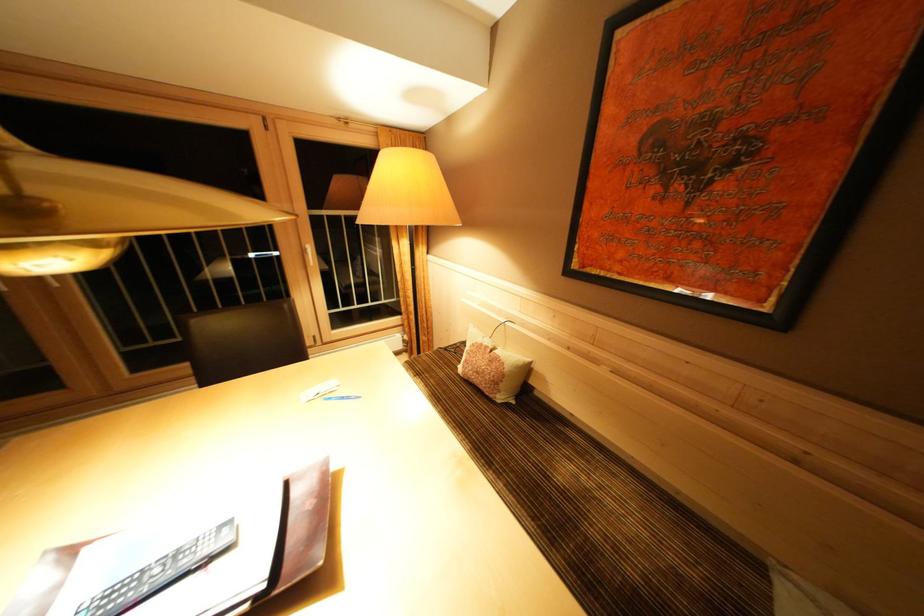
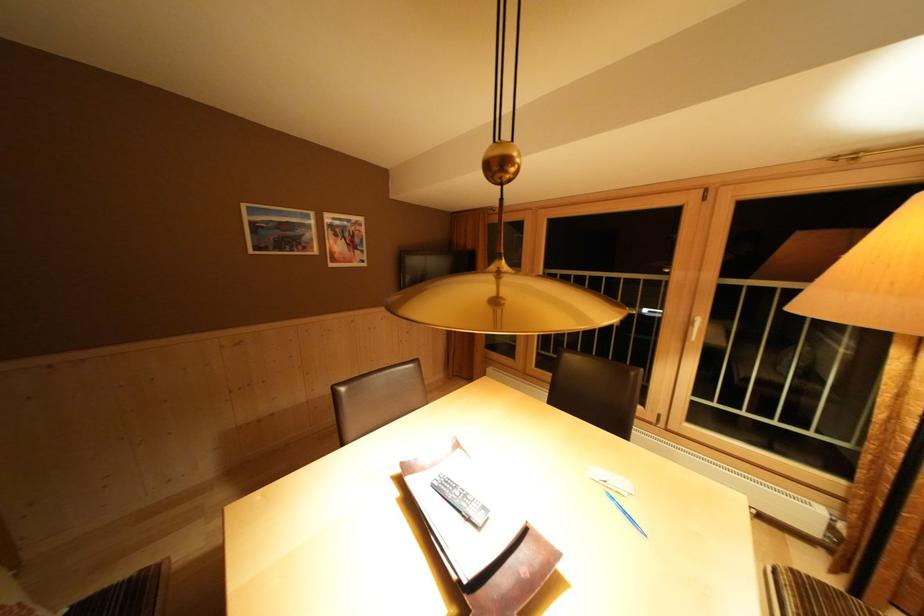
In the second image, find the point that corresponds to (349,403) in the first image.

(633, 517)